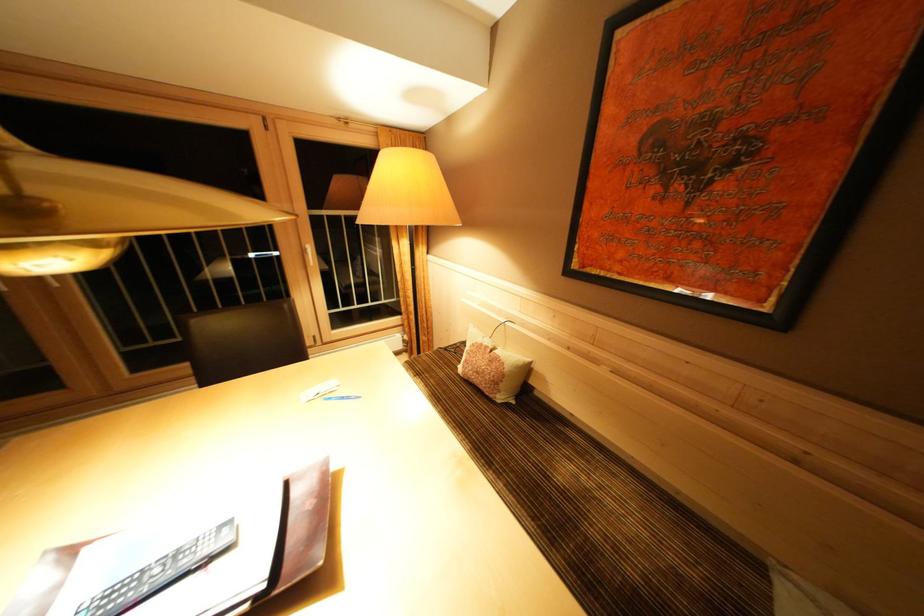
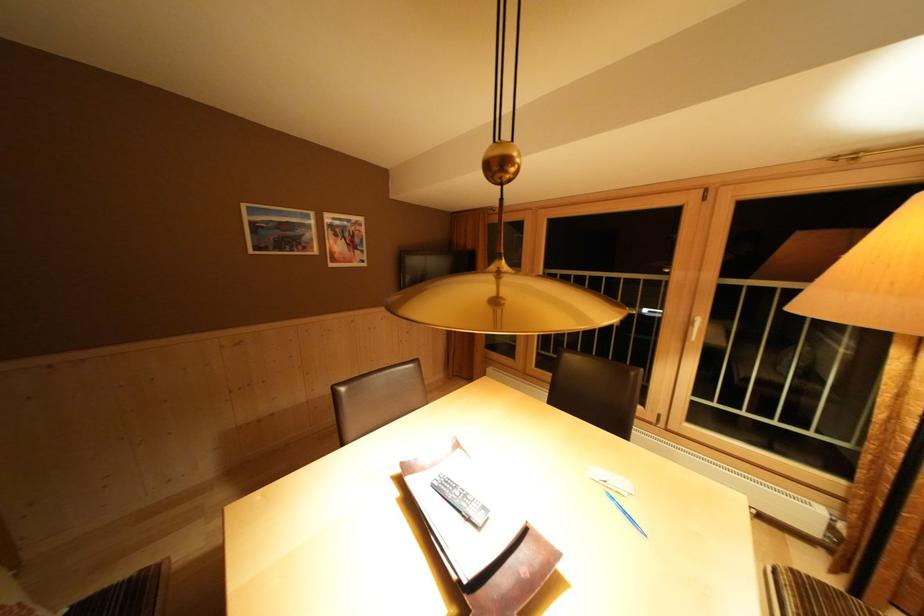
In the second image, find the point that corresponds to (349,403) in the first image.

(633, 517)